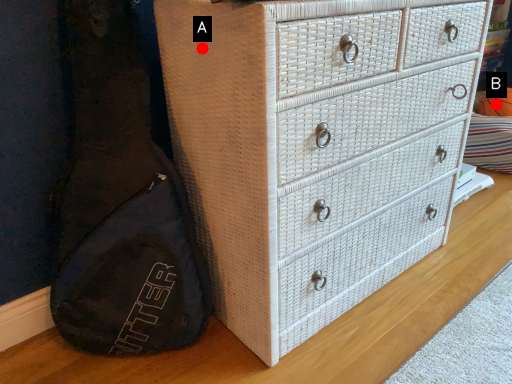
Question: Two points are circled on the image, labeled by A and B beside each circle. Which point is closer to the camera?

Choices:
 (A) A is closer
 (B) B is closer

Answer: (A)